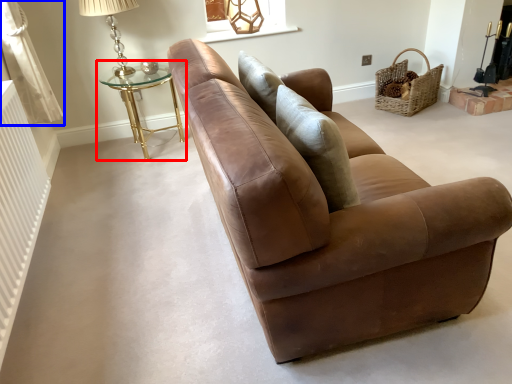
Question: Which object appears closest to the camera in this image, table (highlighted by a red box) or curtain (highlighted by a blue box)?

Choices:
 (A) table
 (B) curtain

Answer: (B)